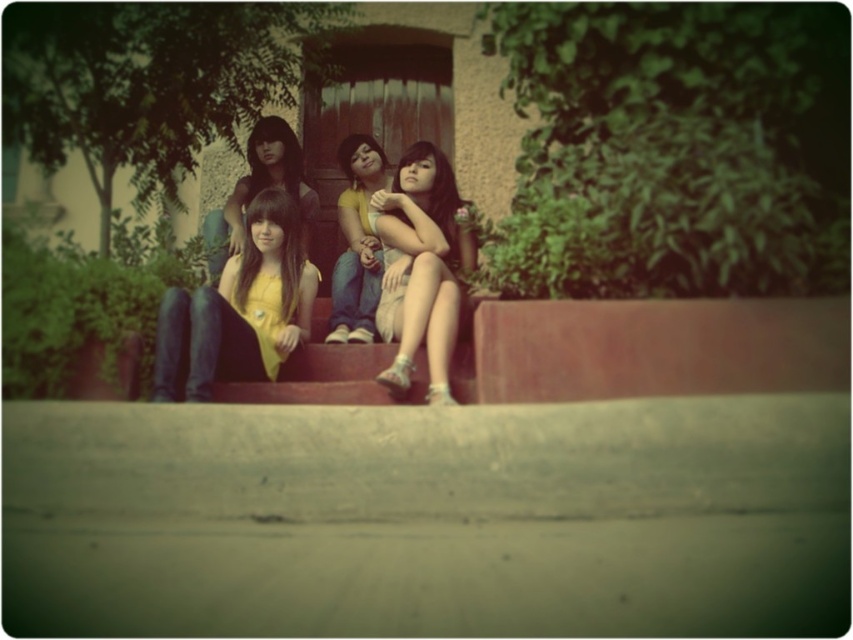
Question: Estimate the real-world distances between objects in this image. Which object is closer to the yellow matte dress at center?

Choices:
 (A) matte yellow shirt at center
 (B) matte gray dress at center

Answer: (B)

Question: Does yellow matte dress at center have a larger size compared to matte gray dress at center?

Choices:
 (A) no
 (B) yes

Answer: (A)

Question: Which object is positioned farthest from the yellow matte dress at center?

Choices:
 (A) yellow fabric shirt at center
 (B) matte yellow shirt at center

Answer: (B)

Question: Is yellow matte dress at center positioned before matte yellow shirt at center?

Choices:
 (A) no
 (B) yes

Answer: (B)

Question: Is matte gray dress at center wider than yellow fabric shirt at center?

Choices:
 (A) no
 (B) yes

Answer: (B)

Question: Which point is farther to the camera?

Choices:
 (A) [271, 147]
 (B) [418, 154]

Answer: (A)